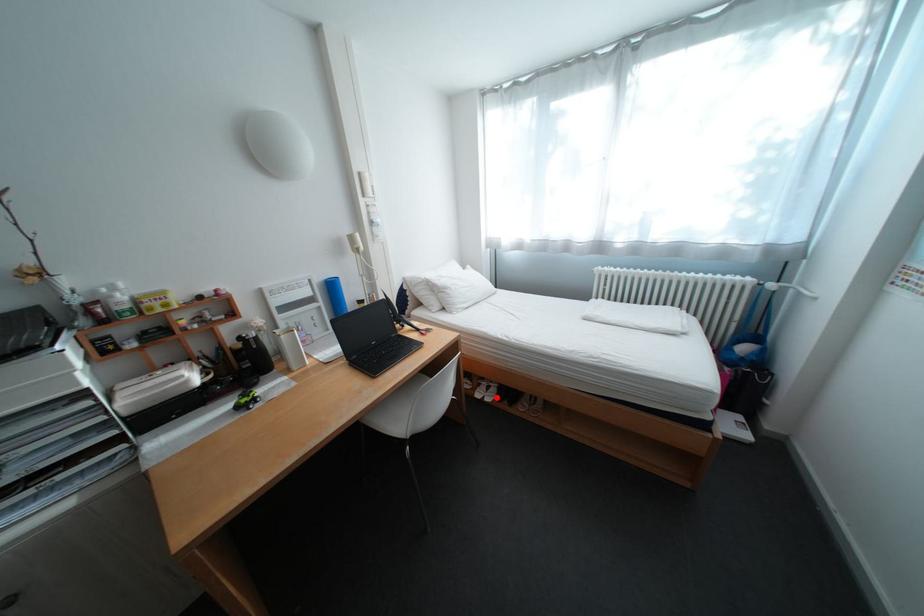
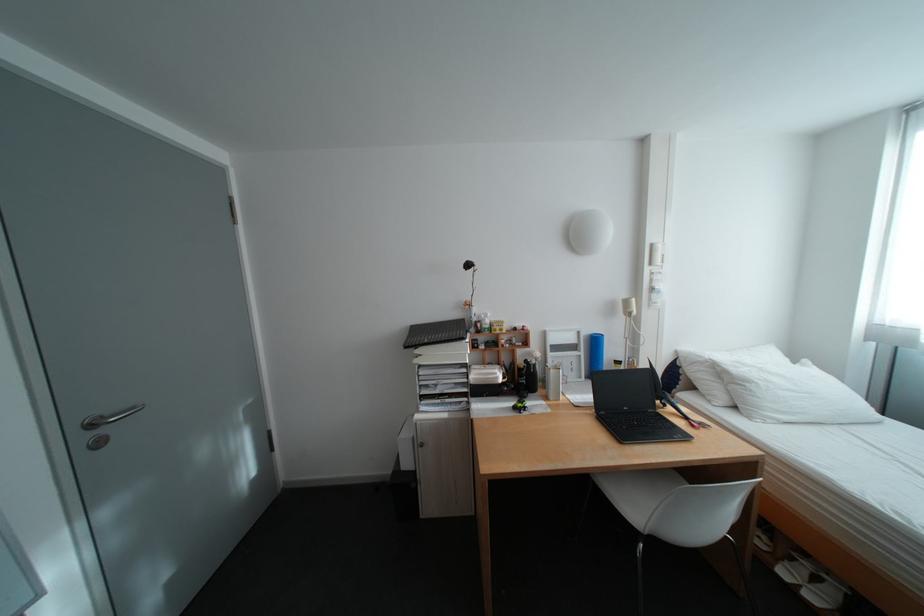
Question: A red point is marked in image1. In image2, is the corresponding 3D point closer to the camera or farther? Reply with the corresponding letter.

Choices:
 (A) The corresponding 3D point is closer.
 (B) The corresponding 3D point is farther.

Answer: (A)